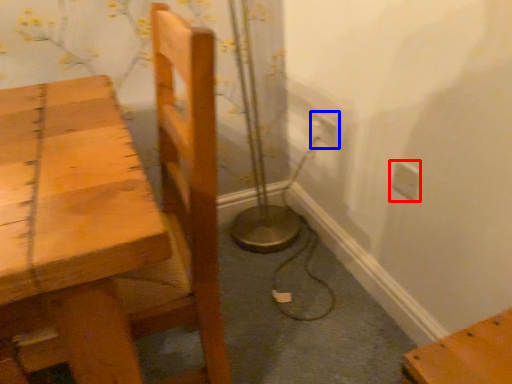
Question: Which point is closer to the camera, electric outlet (highlighted by a red box) or electric outlet (highlighted by a blue box)?

Choices:
 (A) electric outlet
 (B) electric outlet

Answer: (A)